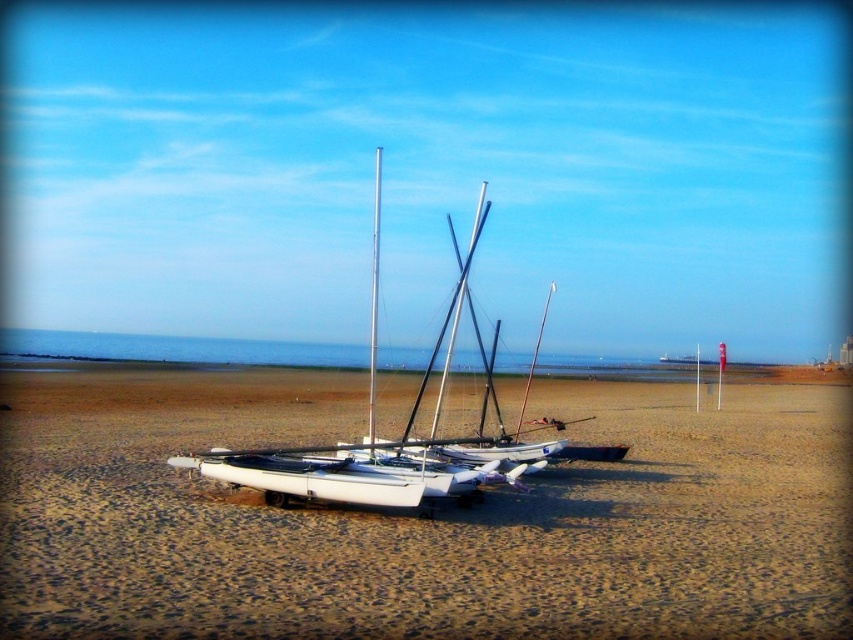
Question: Among these objects, which one is farthest from the camera?

Choices:
 (A) white sand at center
 (B) silver metallic mast at center

Answer: (B)

Question: Is white sand at center above silver metallic mast at center?

Choices:
 (A) no
 (B) yes

Answer: (A)

Question: Which object is closer to the camera taking this photo?

Choices:
 (A) white sand at center
 (B) silver metallic mast at center

Answer: (A)

Question: Among these objects, which one is farthest from the camera?

Choices:
 (A) silver metallic mast at center
 (B) white sand at center

Answer: (A)

Question: Does white sand at center appear under silver metallic mast at center?

Choices:
 (A) no
 (B) yes

Answer: (B)

Question: Does white sand at center appear on the left side of silver metallic mast at center?

Choices:
 (A) yes
 (B) no

Answer: (B)